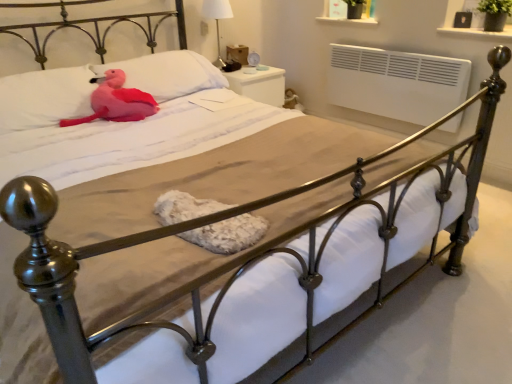
Question: Should I look upward or downward to see white fabric lampshade at upper center?

Choices:
 (A) down
 (B) up

Answer: (B)

Question: Are pink plush at upper left, the 2th pillow when ordered from right to left, and pink plush toy at upper left beside each other?

Choices:
 (A) no
 (B) yes

Answer: (A)

Question: Is pink plush at upper left, which appears as the 1th pillow when viewed from the left, surrounding pink plush toy at upper left?

Choices:
 (A) yes
 (B) no

Answer: (A)

Question: Is pink plush at upper left, the 2th pillow when ordered from right to left, positioned with its back to pink plush toy at upper left?

Choices:
 (A) yes
 (B) no

Answer: (A)

Question: Does pink plush at upper left, the 2th pillow when ordered from right to left, have a larger size compared to pink plush toy at upper left?

Choices:
 (A) yes
 (B) no

Answer: (A)

Question: Can you confirm if pink plush at upper left, which appears as the 1th pillow when viewed from the left, is wider than pink plush toy at upper left?

Choices:
 (A) no
 (B) yes

Answer: (A)

Question: Is pink plush at upper left, which appears as the 1th pillow when viewed from the left, shorter than pink plush toy at upper left?

Choices:
 (A) yes
 (B) no

Answer: (B)

Question: Is matte pink pillow at upper left, acting as the 2th pillow starting from the left, smaller than white fabric lampshade at upper center?

Choices:
 (A) yes
 (B) no

Answer: (B)

Question: Is matte pink pillow at upper left, acting as the 2th pillow starting from the left, positioned in front of white fabric lampshade at upper center?

Choices:
 (A) no
 (B) yes

Answer: (B)

Question: Is matte pink pillow at upper left, which is the 1th pillow from right to left, not inside white fabric lampshade at upper center?

Choices:
 (A) no
 (B) yes

Answer: (B)

Question: Does matte pink pillow at upper left, acting as the 2th pillow starting from the left, have a greater width compared to white fabric lampshade at upper center?

Choices:
 (A) no
 (B) yes

Answer: (B)

Question: Is matte pink pillow at upper left, which is the 1th pillow from right to left, facing towards white fabric lampshade at upper center?

Choices:
 (A) no
 (B) yes

Answer: (A)

Question: Considering the relative sizes of matte pink pillow at upper left, which is the 1th pillow from right to left, and white fabric lampshade at upper center in the image provided, is matte pink pillow at upper left, which is the 1th pillow from right to left, thinner than white fabric lampshade at upper center?

Choices:
 (A) no
 (B) yes

Answer: (A)

Question: Considering the relative sizes of matte pink pillow at upper left, acting as the 2th pillow starting from the left, and pink plush at upper left, the 2th pillow when ordered from right to left, in the image provided, is matte pink pillow at upper left, acting as the 2th pillow starting from the left, smaller than pink plush at upper left, the 2th pillow when ordered from right to left,?

Choices:
 (A) yes
 (B) no

Answer: (B)